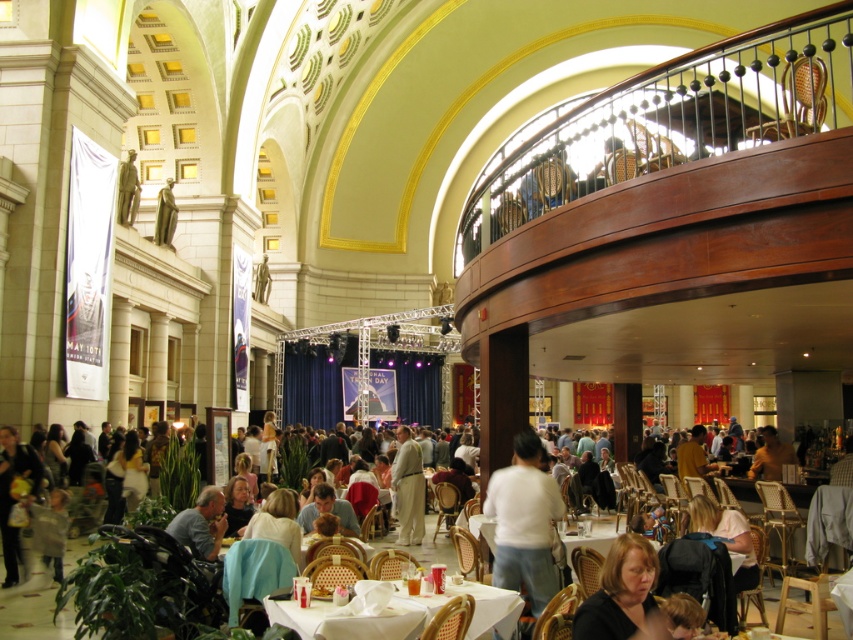
You are a photographer at the event and want to capture a photo that includes both the light beige fabric suit at center and the bronze statue at upper center. Which object should you place on the right side of the other to ensure both are in the frame?

To include both the light beige fabric suit at center and the bronze statue at upper center in the frame, you should position the light beige fabric suit at center on the right side of the bronze statue at upper center, as it is already naturally positioned there according to the scene description.

You are attending an event in this grand hall and notice two items of interest. You want to take a photo of the light beige fabric suit at center and the bronze statue at upper center together in the same frame. Based on their positions, can you position yourself so that both are visible in your camera view?

The light beige fabric suit at center is located below the bronze statue at upper center, so positioning yourself at a slight distance and looking upwards should allow both the light beige fabric suit at center and the bronze statue at upper center to be captured in the same frame.

You are standing in the grand hall and see the point marked at coordinates (407,488). What object or feature is located at that point?

The point at coordinates (407,488) corresponds to the light beige fabric suit at center.